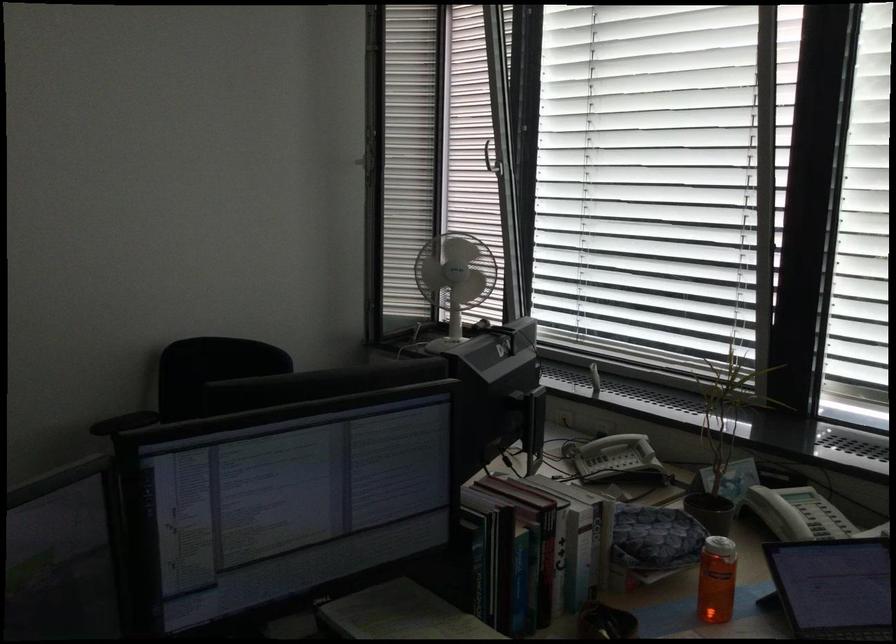
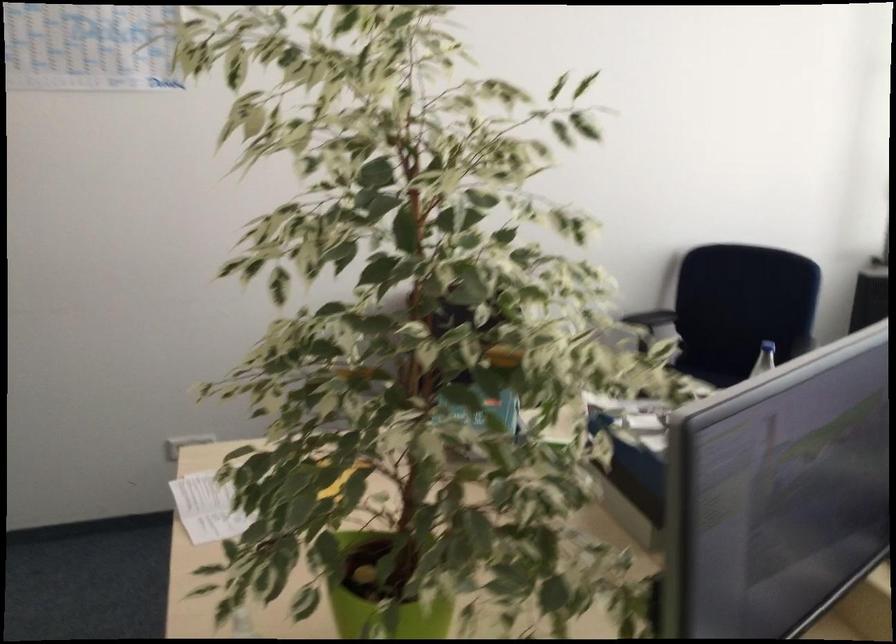
Question: The camera is either moving clockwise (left) or counter-clockwise (right) around the object. The first image is from the beginning of the video and the second image is from the end. Is the camera moving left or right when shooting the video?

Choices:
 (A) Left
 (B) Right

Answer: (B)